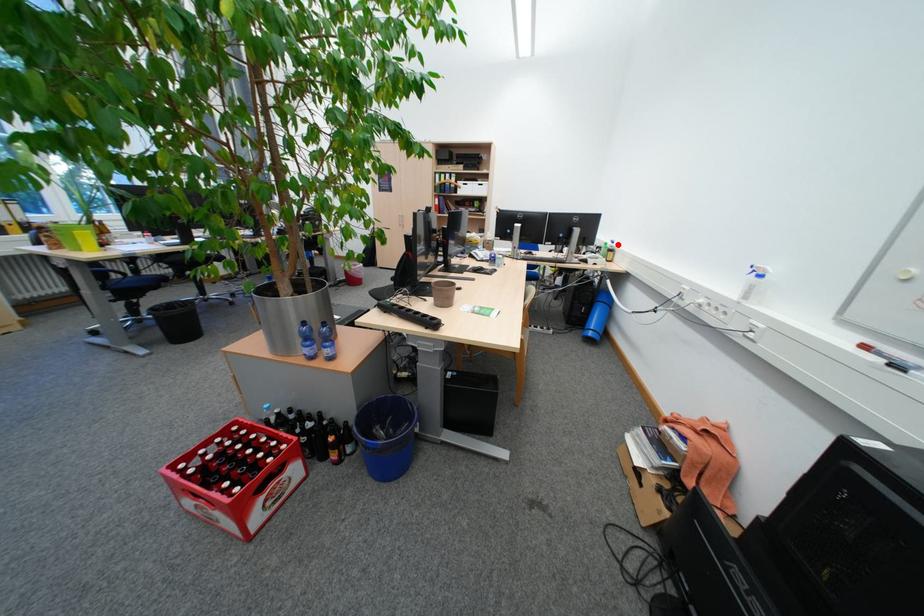
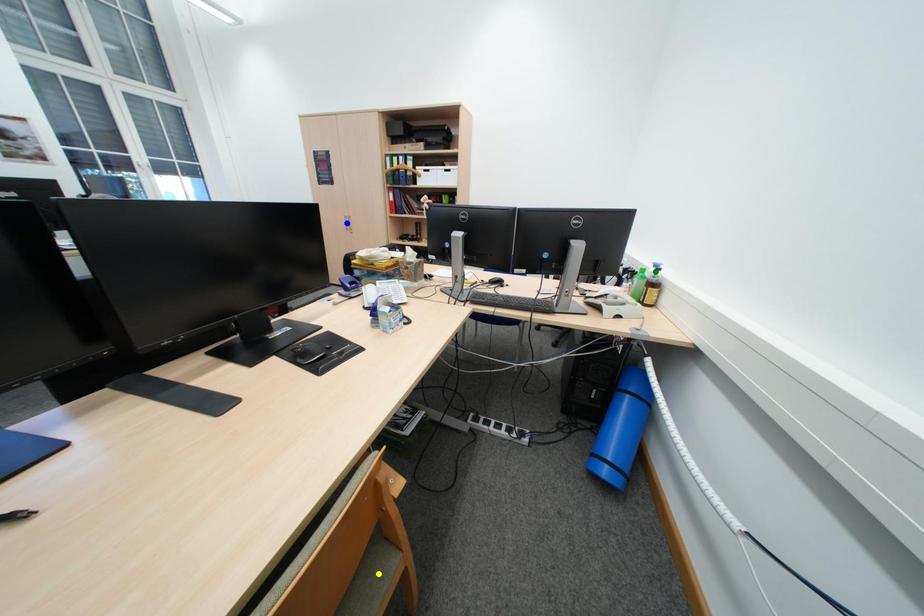
Question: I am providing you with two images of the same scene from different viewpoints. A red point is marked on the first image. You are given multiple points on the second image. In image 2, which mark is for the same physical point as the one in image 1?

Choices:
 (A) yellow point
 (B) blue point
 (C) green point

Answer: (C)